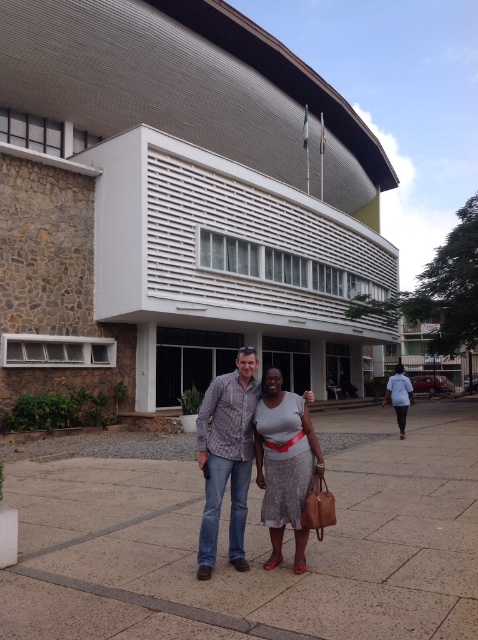
Question: Which point is farther to the camera?

Choices:
 (A) light blue fabric at center
 (B) plaid shirt at center
 (C) silver metallic dress at center

Answer: (A)

Question: Is plaid shirt at center in front of silver metallic dress at center?

Choices:
 (A) yes
 (B) no

Answer: (B)

Question: Is silver metallic dress at center above light blue fabric at center?

Choices:
 (A) yes
 (B) no

Answer: (A)

Question: Which object is the closest to the light blue fabric at center?

Choices:
 (A) silver metallic dress at center
 (B) plaid shirt at center

Answer: (B)

Question: Can you confirm if plaid shirt at center is positioned above light blue fabric at center?

Choices:
 (A) yes
 (B) no

Answer: (A)

Question: Among these points, which one is nearest to the camera?

Choices:
 (A) (265, 515)
 (B) (393, 385)

Answer: (A)